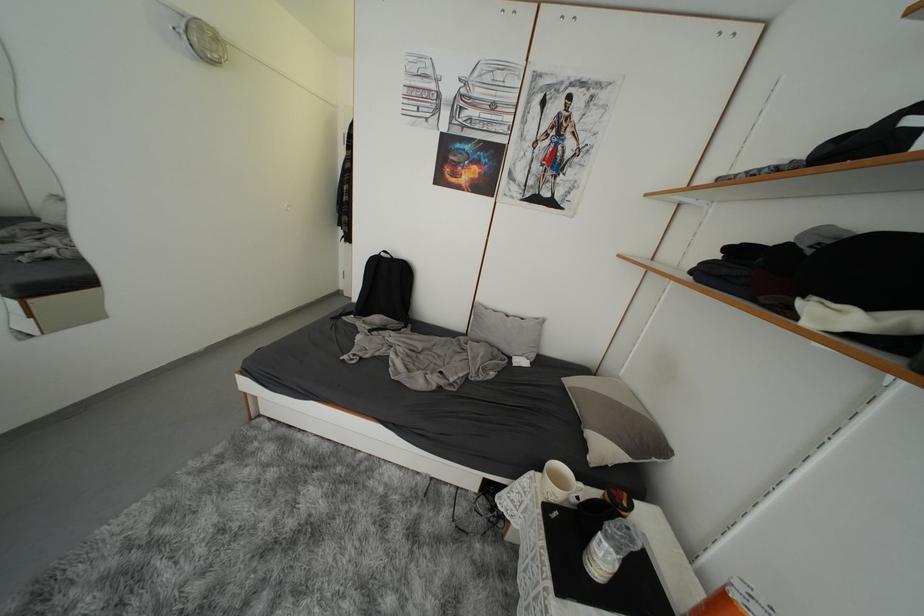
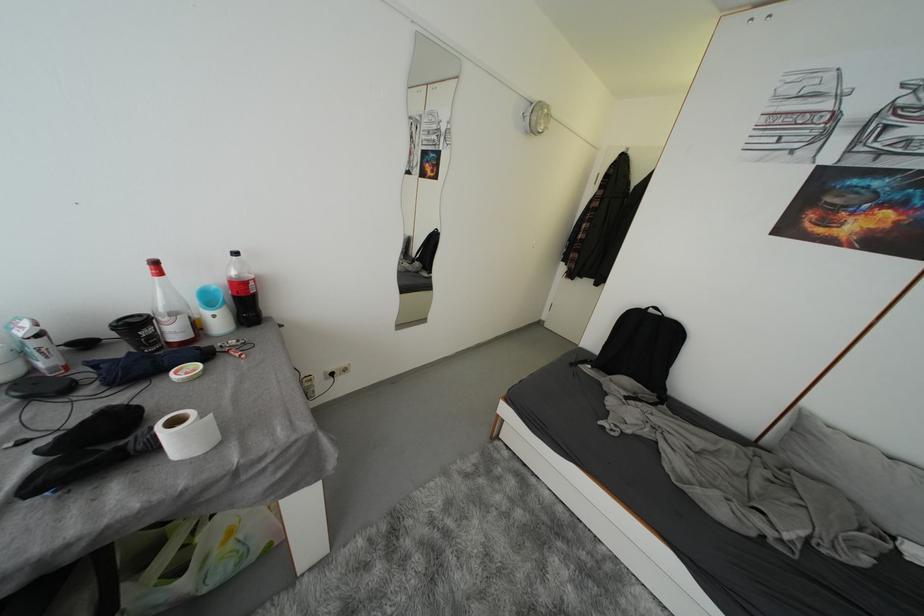
Question: The first image is from the beginning of the video and the second image is from the end. How did the camera likely rotate when shooting the video?

Choices:
 (A) Left
 (B) Right
 (C) Up
 (D) Down

Answer: (A)